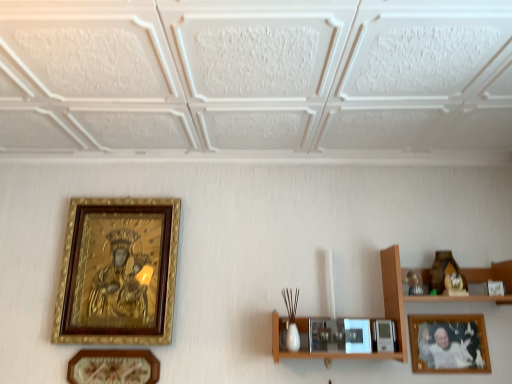
Question: Is wooden framed photo at lower right, which is counted as the 3th picture frame, starting from the left, positioned with its back to wooden shelf at right?

Choices:
 (A) no
 (B) yes

Answer: (B)

Question: Is the depth of wooden framed photo at lower right, the 1th picture frame viewed from the right, greater than that of wooden shelf at right?

Choices:
 (A) no
 (B) yes

Answer: (B)

Question: From a real-world perspective, does wooden framed photo at lower right, the 1th picture frame viewed from the right, sit lower than wooden shelf at right?

Choices:
 (A) no
 (B) yes

Answer: (B)

Question: Can you confirm if wooden framed photo at lower right, the 1th picture frame viewed from the right, is positioned to the left of wooden shelf at right?

Choices:
 (A) no
 (B) yes

Answer: (A)

Question: Considering the relative positions of wooden framed photo at lower right, the 1th picture frame viewed from the right, and wooden shelf at right in the image provided, is wooden framed photo at lower right, the 1th picture frame viewed from the right, to the right of wooden shelf at right from the viewer's perspective?

Choices:
 (A) yes
 (B) no

Answer: (A)

Question: Is matte gold picture frame at lower left, the 2th picture frame in the left-to-right sequence, in front of or behind goldwooden framepicture frame at left, the 1th picture frame from the left, in the image?

Choices:
 (A) front
 (B) behind

Answer: (A)

Question: In terms of width, does matte gold picture frame at lower left, the 2th picture frame in the left-to-right sequence, look wider or thinner when compared to goldwooden framepicture frame at left, marked as the third picture frame in a right-to-left arrangement?

Choices:
 (A) wide
 (B) thin

Answer: (B)

Question: From the image's perspective, is matte gold picture frame at lower left, marked as the 2th picture frame in a right-to-left arrangement, located above or below goldwooden framepicture frame at left, marked as the third picture frame in a right-to-left arrangement?

Choices:
 (A) below
 (B) above

Answer: (A)

Question: Is matte gold picture frame at lower left, marked as the 2th picture frame in a right-to-left arrangement, bigger or smaller than goldwooden framepicture frame at left, marked as the third picture frame in a right-to-left arrangement?

Choices:
 (A) small
 (B) big

Answer: (A)

Question: Does point (165, 258) appear closer or farther from the camera than point (495, 299)?

Choices:
 (A) closer
 (B) farther

Answer: (B)

Question: Do you think goldwooden framepicture frame at left, marked as the third picture frame in a right-to-left arrangement, is within wooden shelf at right, or outside of it?

Choices:
 (A) outside
 (B) inside

Answer: (A)

Question: From the image's perspective, is goldwooden framepicture frame at left, marked as the third picture frame in a right-to-left arrangement, above or below wooden shelf at right?

Choices:
 (A) below
 (B) above

Answer: (B)

Question: From a real-world perspective, is goldwooden framepicture frame at left, the 1th picture frame from the left, positioned above or below wooden shelf at right?

Choices:
 (A) above
 (B) below

Answer: (A)

Question: Considering the positions of goldwooden framepicture frame at left, marked as the third picture frame in a right-to-left arrangement, and matte gold picture frame at lower left, the 2th picture frame in the left-to-right sequence, in the image, is goldwooden framepicture frame at left, marked as the third picture frame in a right-to-left arrangement, wider or thinner than matte gold picture frame at lower left, the 2th picture frame in the left-to-right sequence,?

Choices:
 (A) thin
 (B) wide

Answer: (B)

Question: From a real-world perspective, relative to matte gold picture frame at lower left, marked as the 2th picture frame in a right-to-left arrangement, is goldwooden framepicture frame at left, the 1th picture frame from the left, vertically above or below?

Choices:
 (A) below
 (B) above

Answer: (B)